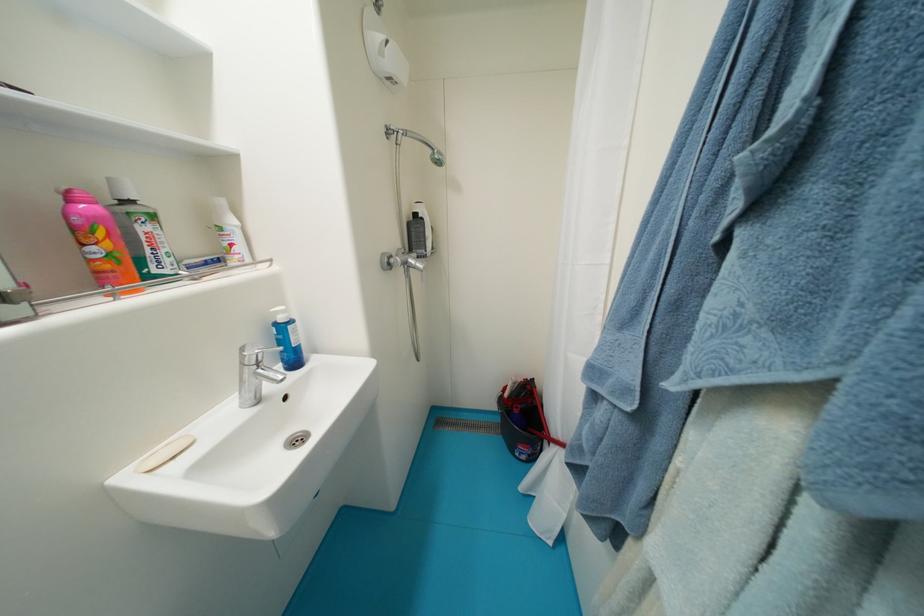
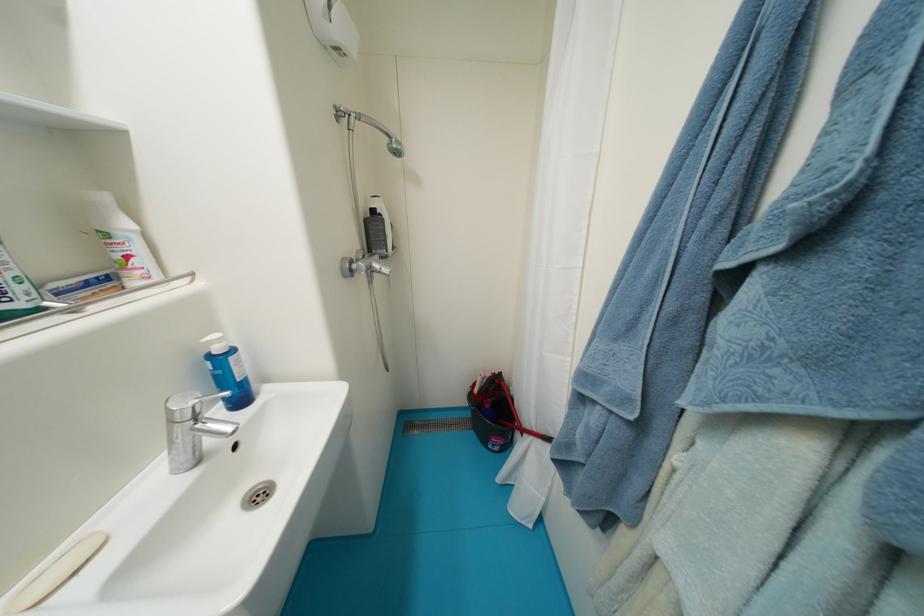
Question: Based on the continuous images, in which direction is the camera rotating? Reply with the corresponding letter.

Choices:
 (A) Left
 (B) Right
 (C) Up
 (D) Down

Answer: (B)